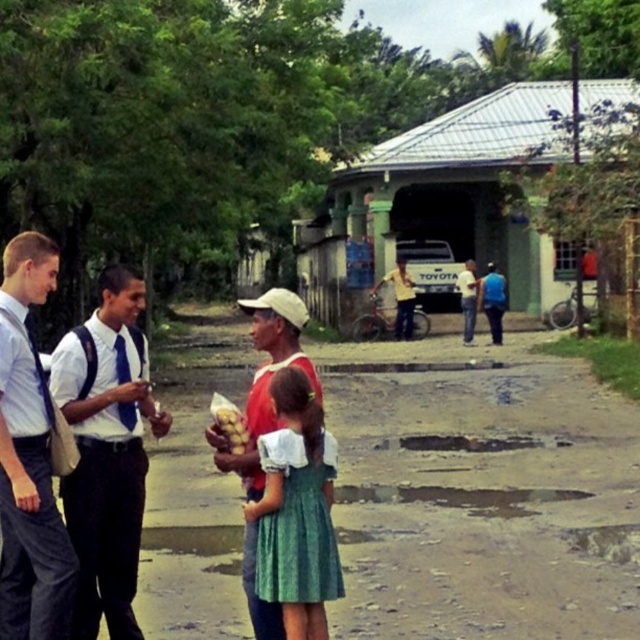
Question: Among these points, which one is nearest to the camera?

Choices:
 (A) (509, 532)
 (B) (32, 566)
 (C) (316, 496)
 (D) (108, 531)

Answer: (C)

Question: Can you confirm if green corrugated metal hut at center is smaller than green textured dress at center?

Choices:
 (A) no
 (B) yes

Answer: (A)

Question: Which object appears farthest from the camera in this image?

Choices:
 (A) blue denim jeans at center
 (B) white cotton shirt at left
 (C) green cotton dress at center

Answer: (A)

Question: Among these points, which one is nearest to the camera?

Choices:
 (A) (113, 387)
 (B) (465, 296)
 (C) (262, 374)

Answer: (C)

Question: Does white cotton shirt at left appear on the left side of blue denim jeans at center?

Choices:
 (A) no
 (B) yes

Answer: (B)

Question: Is green corrugated metal hut at center bigger than white shirt with tie at left?

Choices:
 (A) no
 (B) yes

Answer: (B)